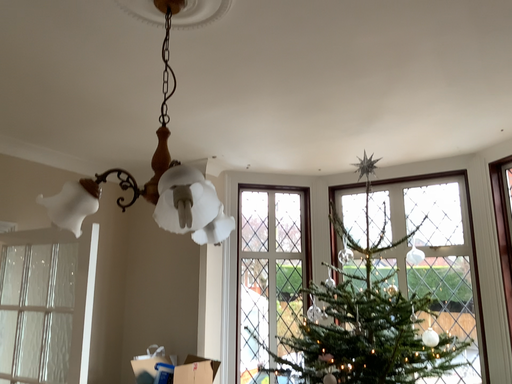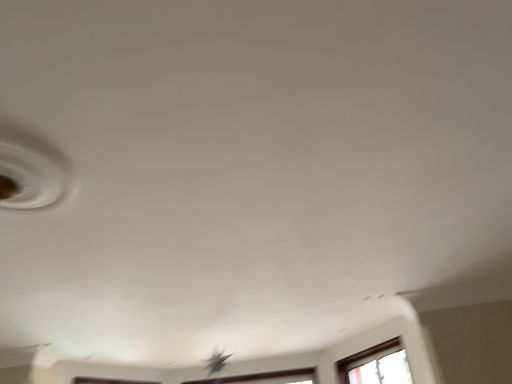
Question: How did the camera likely rotate when shooting the video?

Choices:
 (A) rotated downward
 (B) rotated upward

Answer: (B)